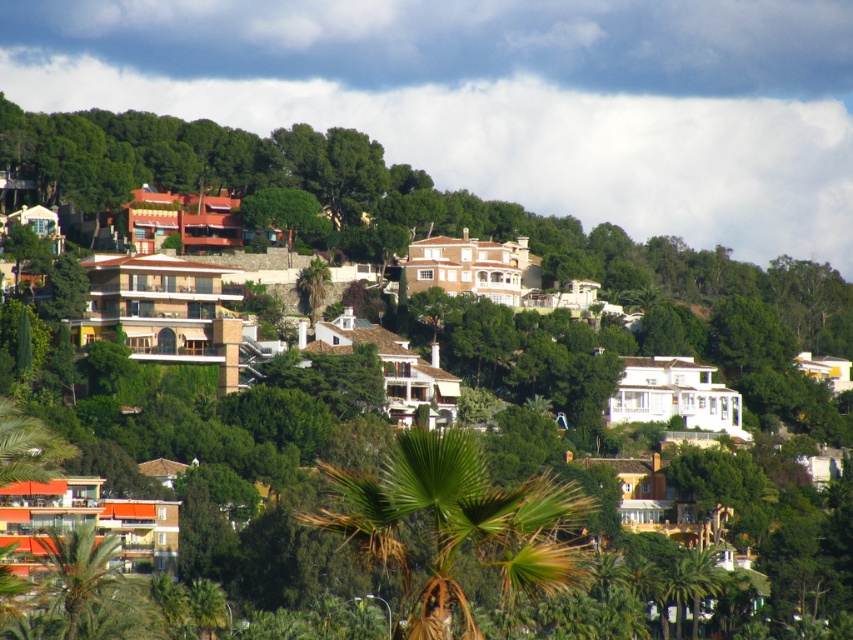
Question: Considering the real-world distances, which object is farthest from the white fluffy cloud at upper center?

Choices:
 (A) green leafy palm tree at center
 (B) green leafy palm tree at lower left

Answer: (B)

Question: Estimate the real-world distances between objects in this image. Which object is closer to the green leafy palm tree at center?

Choices:
 (A) green leafy palm tree at lower left
 (B) white fluffy cloud at upper center

Answer: (A)

Question: Does white fluffy cloud at upper center appear under green leafy palm tree at lower left?

Choices:
 (A) yes
 (B) no

Answer: (B)

Question: Can you confirm if white fluffy cloud at upper center is bigger than green leafy palm tree at lower left?

Choices:
 (A) no
 (B) yes

Answer: (B)

Question: Which point is closer to the camera?

Choices:
 (A) green leafy palm tree at lower left
 (B) white fluffy cloud at upper center
 (C) green leafy palm tree at center

Answer: (C)

Question: Is white fluffy cloud at upper center closer to camera compared to green leafy palm tree at lower left?

Choices:
 (A) yes
 (B) no

Answer: (B)